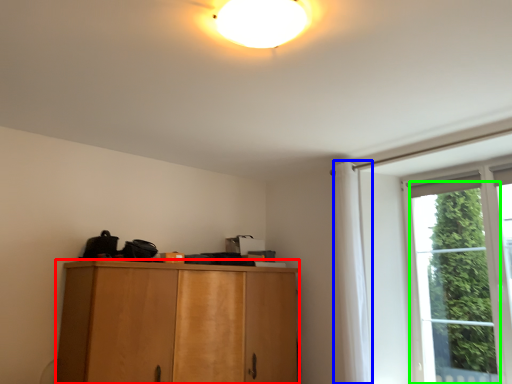
Question: Which object is positioned farthest from cabinetry (highlighted by a red box)? Select from curtain (highlighted by a blue box) and window (highlighted by a green box).

Choices:
 (A) curtain
 (B) window

Answer: (B)